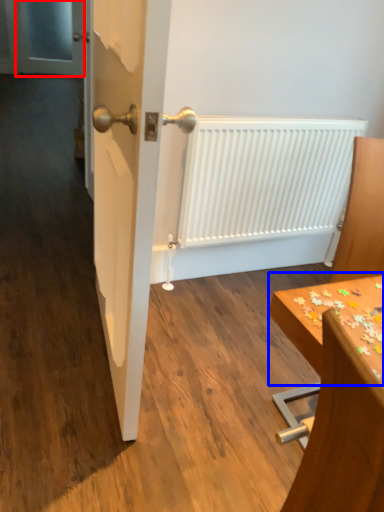
Question: Which object appears farthest to the camera in this image, screen door (highlighted by a red box) or table (highlighted by a blue box)?

Choices:
 (A) screen door
 (B) table

Answer: (A)